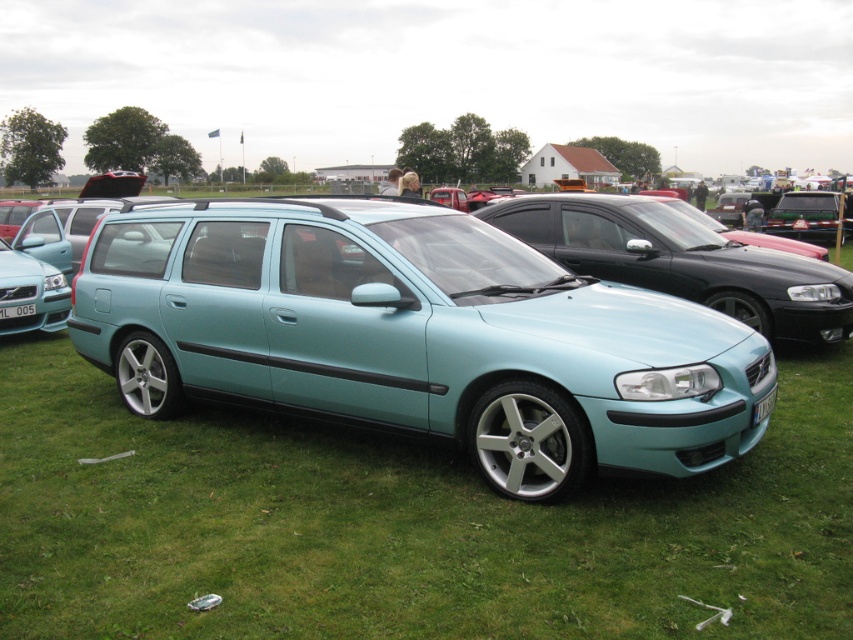
Does light blue metallic sedan at center appear under green metallic license plate at front?

No, light blue metallic sedan at center is not below green metallic license plate at front.

Is light blue metallic sedan at center to the right of green metallic license plate at front from the viewer's perspective?

Incorrect, light blue metallic sedan at center is not on the right side of green metallic license plate at front.

Between point (436, 340) and point (775, 392), which one is positioned behind?

Point (775, 392)

Image resolution: width=853 pixels, height=640 pixels. In order to click on light blue metallic sedan at center in this screenshot , I will do `click(415, 336)`.

Which is below, green metallic license plate at front or white plastic license plate at center?

green metallic license plate at front is lower down.

The image size is (853, 640). What do you see at coordinates (763, 406) in the screenshot? I see `green metallic license plate at front` at bounding box center [763, 406].

Identify the location of green metallic license plate at front. Image resolution: width=853 pixels, height=640 pixels. (763, 406).

Which is behind, point (709, 330) or point (27, 304)?

The point (27, 304) is more distant.

Measure the distance between light blue metallic sedan at center and camera.

light blue metallic sedan at center and camera are 3.77 meters apart from each other.

Identify the location of light blue metallic sedan at center. (415, 336).